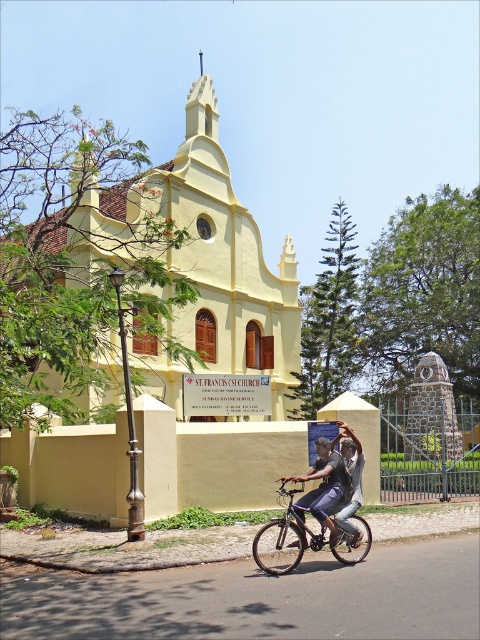
Who is positioned more to the right, yellow matte church at center or denim pants at center?

Positioned to the right is denim pants at center.

Does yellow matte church at center lie in front of denim pants at center?

No, yellow matte church at center is behind denim pants at center.

Where is `yellow matte church at center`? This screenshot has width=480, height=640. yellow matte church at center is located at coordinates (207, 323).

At what (x,y) coordinates should I click in order to perform the action: click on yellow matte church at center. Please return your answer as a coordinate pair (x, y). Looking at the image, I should click on click(x=207, y=323).

Does denim shorts at center come in front of denim pants at center?

Yes.

Does point (339, 480) lie in front of point (349, 506)?

No, it is not.

I want to click on denim shorts at center, so click(324, 486).

Can you confirm if silver metallic bicycle at center is positioned below denim pants at center?

Yes, silver metallic bicycle at center is below denim pants at center.

Is the position of silver metallic bicycle at center less distant than that of denim pants at center?

Yes, silver metallic bicycle at center is in front of denim pants at center.

Between point (292, 497) and point (351, 529), which one is positioned in front?

Positioned in front is point (351, 529).

Find the location of a particular element. Image resolution: width=480 pixels, height=640 pixels. silver metallic bicycle at center is located at coordinates (285, 538).